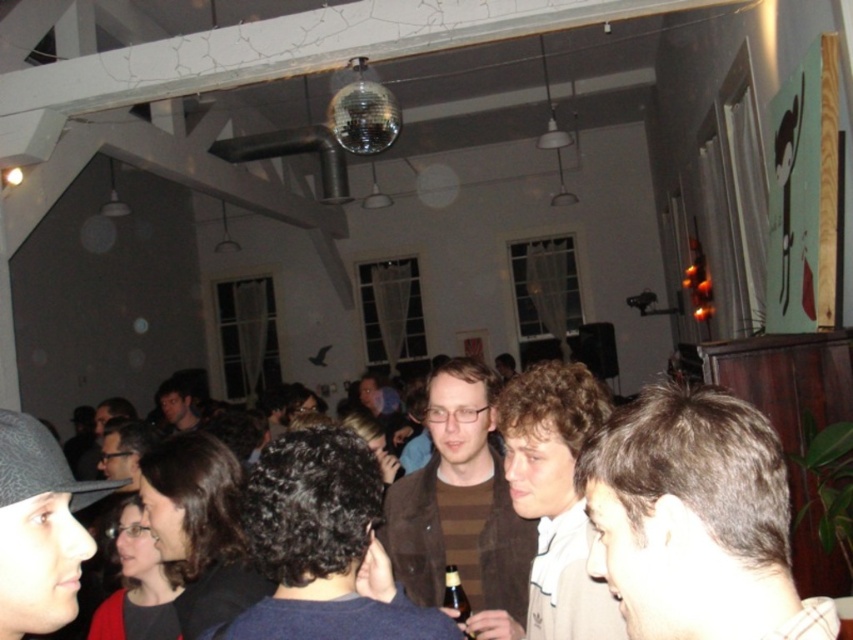
You are organizing a coat rack and need to hang both the brown wool sweater at center and the matte black hat at lower left. Since the coat rack has limited vertical space, which item should you hang first to ensure both fit vertically?

The brown wool sweater at center is taller than the matte black hat at lower left. To ensure both fit vertically on the coat rack, you should hang the brown wool sweater at center first, then the matte black hat at lower left below it.

You are at a party and want to grab the matte black hat at lower left. However, there is a brown matte sweater at center in the way. Can you reach the hat without moving the sweater?

The brown matte sweater at center is below the matte black hat at lower left, so you can reach the matte black hat at lower left without moving the sweater because it is positioned higher up.

You are organizing a clothing donation drive and need to place the brown wool sweater at center into a box. The box has a maximum capacity of 1 cubic meter. Can you determine if the sweater will fit based on its position coordinates?

The brown wool sweater at center is located at point coordinates, but without information about its dimensions, we cannot determine if it will fit into the box. Please provide the sweater dimensions for an accurate assessment.